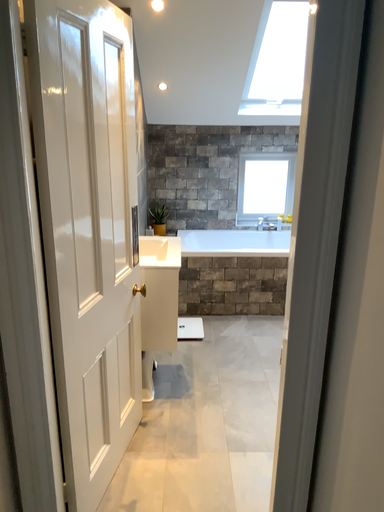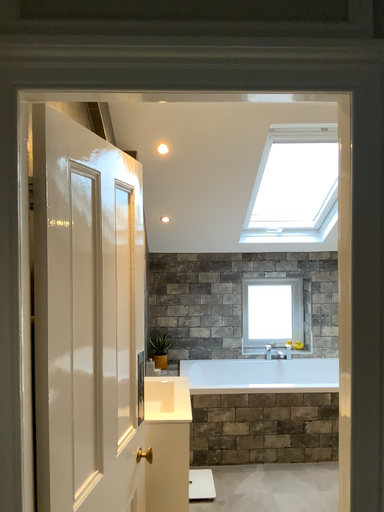
Question: Which way did the camera rotate in the video?

Choices:
 (A) rotated downward
 (B) rotated upward

Answer: (B)